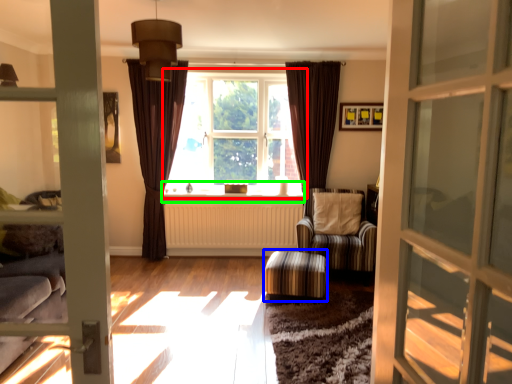
Question: Which object is positioned closest to window (highlighted by a red box)? Select from stool (highlighted by a blue box) and window sill (highlighted by a green box).

Choices:
 (A) stool
 (B) window sill

Answer: (B)